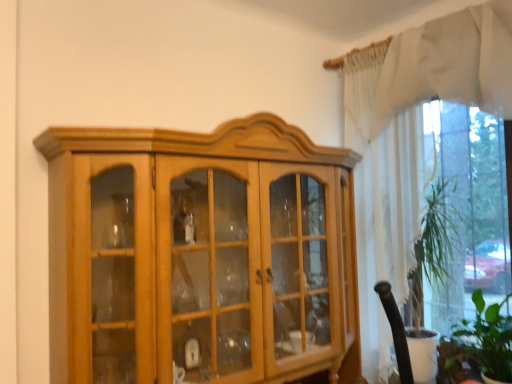
Question: Is the depth of light brown wood cabinet at center greater than that of white sheer curtain at upper right, arranged as the 1th curtain when ordered from the bottom?

Choices:
 (A) yes
 (B) no

Answer: (B)

Question: Does light brown wood cabinet at center appear on the left side of white sheer curtain at upper right, arranged as the 1th curtain when ordered from the bottom?

Choices:
 (A) yes
 (B) no

Answer: (A)

Question: Is light brown wood cabinet at center far from white sheer curtain at upper right, arranged as the 1th curtain when ordered from the bottom?

Choices:
 (A) no
 (B) yes

Answer: (A)

Question: Is light brown wood cabinet at center smaller than white sheer curtain at upper right, arranged as the second curtain when viewed from the top?

Choices:
 (A) no
 (B) yes

Answer: (A)

Question: Considering the relative sizes of light brown wood cabinet at center and white sheer curtain at upper right, arranged as the second curtain when viewed from the top, in the image provided, is light brown wood cabinet at center wider than white sheer curtain at upper right, arranged as the second curtain when viewed from the top,?

Choices:
 (A) no
 (B) yes

Answer: (B)

Question: Considering the relative sizes of light brown wood cabinet at center and white sheer curtain at upper right, arranged as the second curtain when viewed from the top, in the image provided, is light brown wood cabinet at center shorter than white sheer curtain at upper right, arranged as the second curtain when viewed from the top,?

Choices:
 (A) yes
 (B) no

Answer: (A)

Question: Considering the relative sizes of white sheer curtain at upper right, arranged as the second curtain when ordered from the bottom, and white sheer curtain at upper right, arranged as the 1th curtain when ordered from the bottom, in the image provided, is white sheer curtain at upper right, arranged as the second curtain when ordered from the bottom, taller than white sheer curtain at upper right, arranged as the 1th curtain when ordered from the bottom,?

Choices:
 (A) yes
 (B) no

Answer: (B)

Question: Is white sheer curtain at upper right, which ranks as the first curtain in top-to-bottom order, far away from white sheer curtain at upper right, arranged as the second curtain when viewed from the top?

Choices:
 (A) yes
 (B) no

Answer: (B)

Question: Would you say white sheer curtain at upper right, arranged as the 1th curtain when ordered from the bottom, is part of white sheer curtain at upper right, which ranks as the first curtain in top-to-bottom order,'s contents?

Choices:
 (A) yes
 (B) no

Answer: (B)

Question: Does white sheer curtain at upper right, which ranks as the first curtain in top-to-bottom order, appear on the right side of white sheer curtain at upper right, arranged as the 1th curtain when ordered from the bottom?

Choices:
 (A) no
 (B) yes

Answer: (B)

Question: Is white sheer curtain at upper right, which ranks as the first curtain in top-to-bottom order, positioned before white sheer curtain at upper right, arranged as the 1th curtain when ordered from the bottom?

Choices:
 (A) no
 (B) yes

Answer: (B)

Question: From a real-world perspective, is white sheer curtain at upper right, arranged as the second curtain when ordered from the bottom, over white sheer curtain at upper right, arranged as the 1th curtain when ordered from the bottom?

Choices:
 (A) yes
 (B) no

Answer: (A)

Question: Does white sheer curtain at upper right, arranged as the second curtain when ordered from the bottom, come in front of green leafy plant at lower right?

Choices:
 (A) no
 (B) yes

Answer: (B)